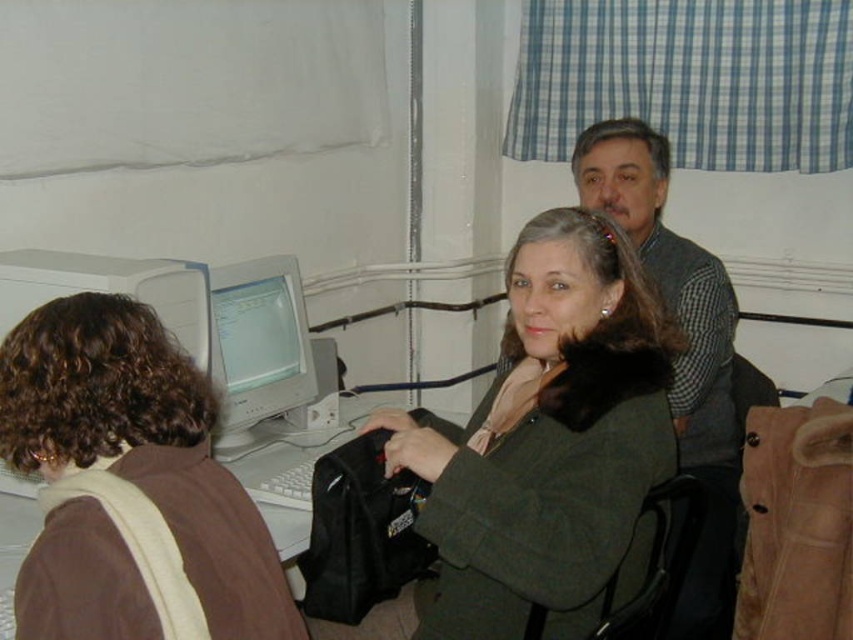
Question: Observing the image, what is the correct spatial positioning of gray wool sweater at upper right in reference to matte gray monitor at center?

Choices:
 (A) left
 (B) right

Answer: (B)

Question: Is brown fuzzy jacket at left positioned behind gray wool sweater at upper right?

Choices:
 (A) no
 (B) yes

Answer: (A)

Question: Which point is farther to the camera?

Choices:
 (A) (299, 289)
 (B) (717, 324)
 (C) (451, 618)

Answer: (A)

Question: Which of these objects is positioned farthest from the gray wool sweater at upper right?

Choices:
 (A) brown fuzzy jacket at left
 (B) matte gray monitor at center

Answer: (A)

Question: Estimate the real-world distances between objects in this image. Which object is farther from the brown fuzzy jacket at left?

Choices:
 (A) green woolen coat at center
 (B) matte gray monitor at center

Answer: (B)

Question: Does green woolen coat at center appear on the left side of gray wool sweater at upper right?

Choices:
 (A) no
 (B) yes

Answer: (B)